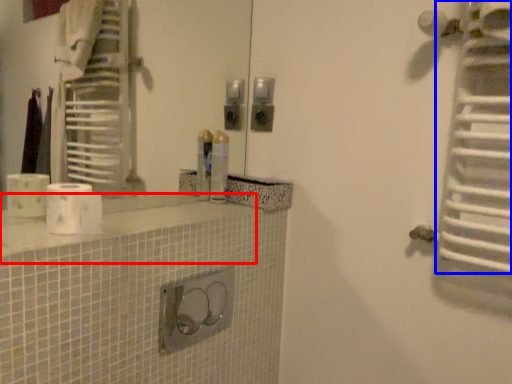
Question: Among these objects, which one is farthest to the camera, counter top (highlighted by a red box) or radiator (highlighted by a blue box)?

Choices:
 (A) counter top
 (B) radiator

Answer: (B)